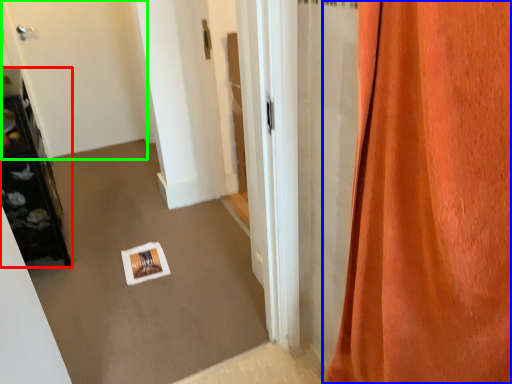
Question: Which object is the closest to the furniture (highlighted by a red box)? Choose among these: curtain (highlighted by a blue box) or door (highlighted by a green box).

Choices:
 (A) curtain
 (B) door

Answer: (B)